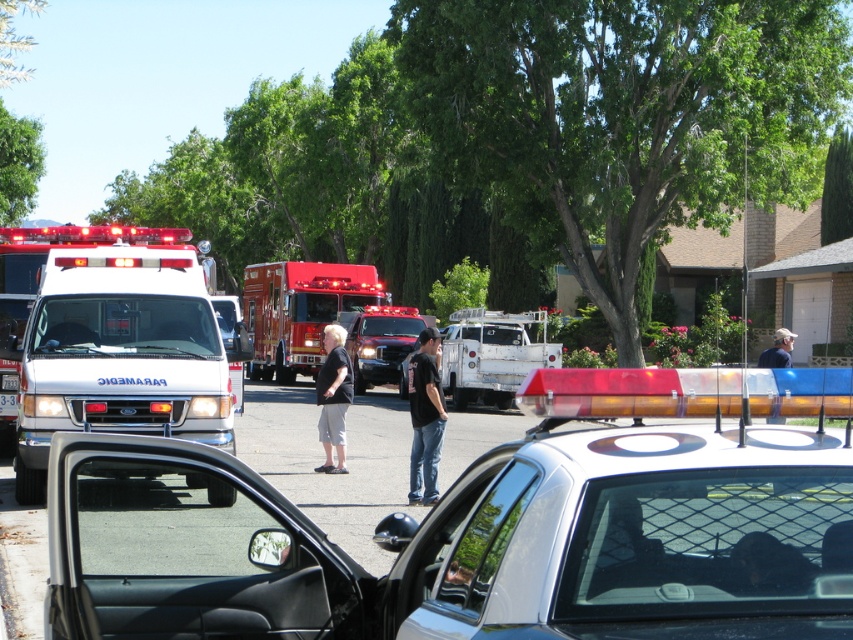
Between black cotton shorts at center and light blue jeans at center, which one is positioned lower?

black cotton shorts at center is below.

Does black cotton shorts at center have a larger size compared to light blue jeans at center?

Actually, black cotton shorts at center might be smaller than light blue jeans at center.

Locate an element on the screen. The width and height of the screenshot is (853, 640). black cotton shorts at center is located at coordinates (334, 397).

Image resolution: width=853 pixels, height=640 pixels. In order to click on black cotton shorts at center in this screenshot , I will do `click(334, 397)`.

Which is in front, point (459, 344) or point (387, 317)?

Point (459, 344)

Is white matte truck at center positioned in front of white glossy ambulance at center?

Yes, white matte truck at center is closer to the viewer.

Which is in front, point (471, 326) or point (405, 332)?

Positioned in front is point (471, 326).

Find the location of a particular element. The height and width of the screenshot is (640, 853). white matte truck at center is located at coordinates coord(491,355).

Does point (410, 454) lie in front of point (328, 337)?

Yes.

Which is more to the left, black cotton shirt at center or black cotton shorts at center?

Positioned to the left is black cotton shorts at center.

Who is more forward, (439, 403) or (350, 397)?

Point (439, 403)

Locate an element on the screen. The width and height of the screenshot is (853, 640). black cotton shirt at center is located at coordinates (425, 419).